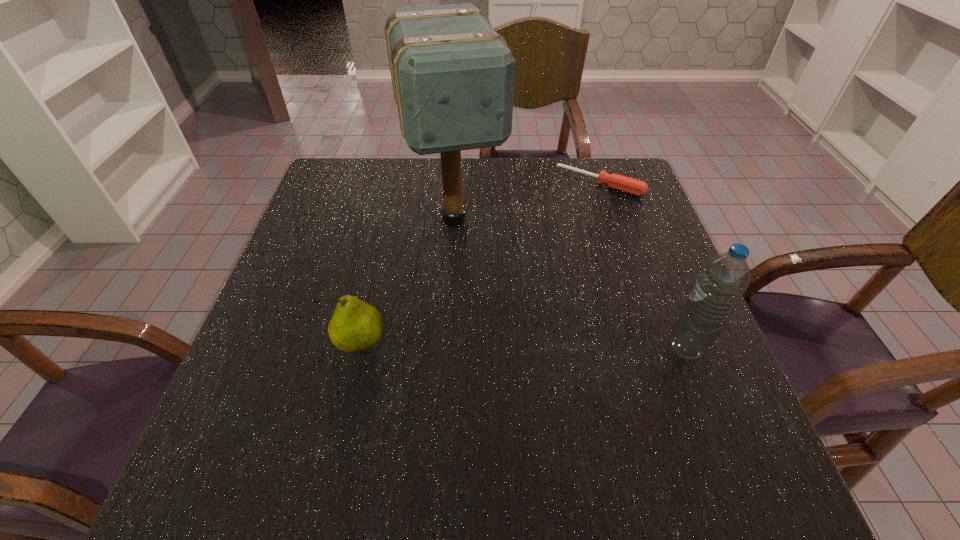
This screenshot has width=960, height=540. What are the coordinates of `the third tallest object` in the screenshot? It's located at (356, 326).

Locate an element on the screen. The height and width of the screenshot is (540, 960). the third shortest object is located at coordinates (723, 280).

The height and width of the screenshot is (540, 960). I want to click on the tallest object, so click(x=452, y=75).

You are a GUI agent. You are given a task and a screenshot of the screen. Output one action in this format:
    pyautogui.click(x=<x>, y=<y>)
    Task: Click on the screwdriver
    Image resolution: width=960 pixels, height=540 pixels.
    Given the screenshot: What is the action you would take?
    pyautogui.click(x=632, y=186)

Identify the location of free space located 0.170m on the back of the pear. The height and width of the screenshot is (540, 960). (377, 268).

The image size is (960, 540). I want to click on vacant region located on the left of the third shortest object, so click(x=641, y=349).

The height and width of the screenshot is (540, 960). In order to click on free spot located on the striking surface of the tallest object in this screenshot , I will do `click(476, 307)`.

This screenshot has width=960, height=540. I want to click on vacant space located on the striking surface of the tallest object, so click(x=497, y=381).

Identify the location of free space located on the striking surface of the tallest object. (493, 367).

I want to click on vacant point located 0.250m at the blade of the shortest object, so click(x=544, y=250).